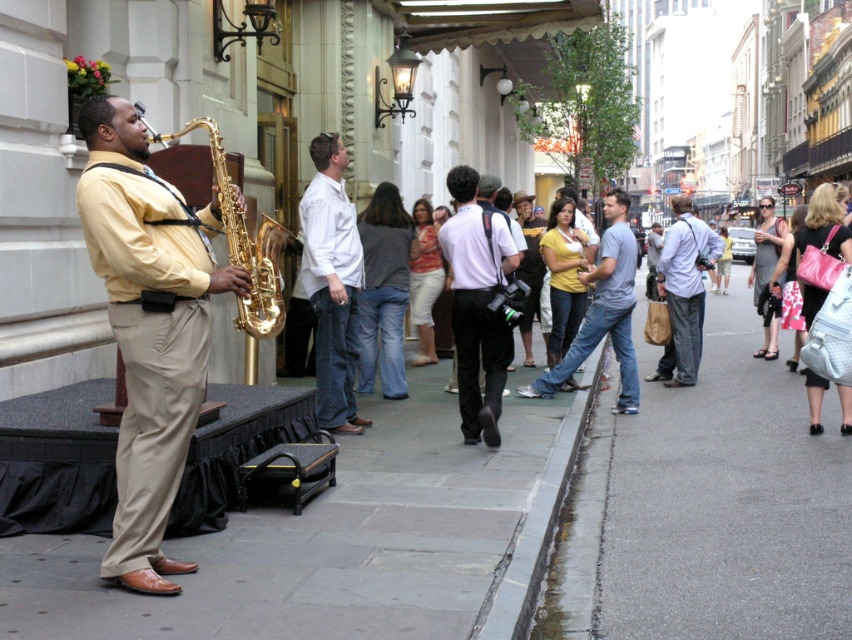
Which of these two, matte gold saxophone at left or white matte shirt at center, stands shorter?

Standing shorter between the two is white matte shirt at center.

Can you confirm if matte gold saxophone at left is bigger than white matte shirt at center?

Yes.

This screenshot has width=852, height=640. In order to click on matte gold saxophone at left in this screenshot , I will do `click(148, 326)`.

This screenshot has width=852, height=640. I want to click on matte gold saxophone at left, so (x=148, y=326).

Who is higher up, gray concrete sidewalk at lower left or white matte shirt at center?

white matte shirt at center is higher up.

Is point (112, 611) in front of point (481, 356)?

Yes, point (112, 611) is closer to viewer.

Is point (435, 493) in front of point (468, 410)?

Yes, it is in front of point (468, 410).

Where is `gray concrete sidewalk at lower left`? This screenshot has height=640, width=852. gray concrete sidewalk at lower left is located at coordinates (343, 541).

Can you confirm if gray concrete sidewalk at lower left is positioned to the right of white cotton shirt at center?

Yes, gray concrete sidewalk at lower left is to the right of white cotton shirt at center.

Which is more to the right, gray concrete sidewalk at lower left or white cotton shirt at center?

From the viewer's perspective, gray concrete sidewalk at lower left appears more on the right side.

Between point (44, 596) and point (340, 369), which one is positioned behind?

Point (340, 369)

This screenshot has width=852, height=640. I want to click on gray concrete sidewalk at lower left, so click(x=343, y=541).